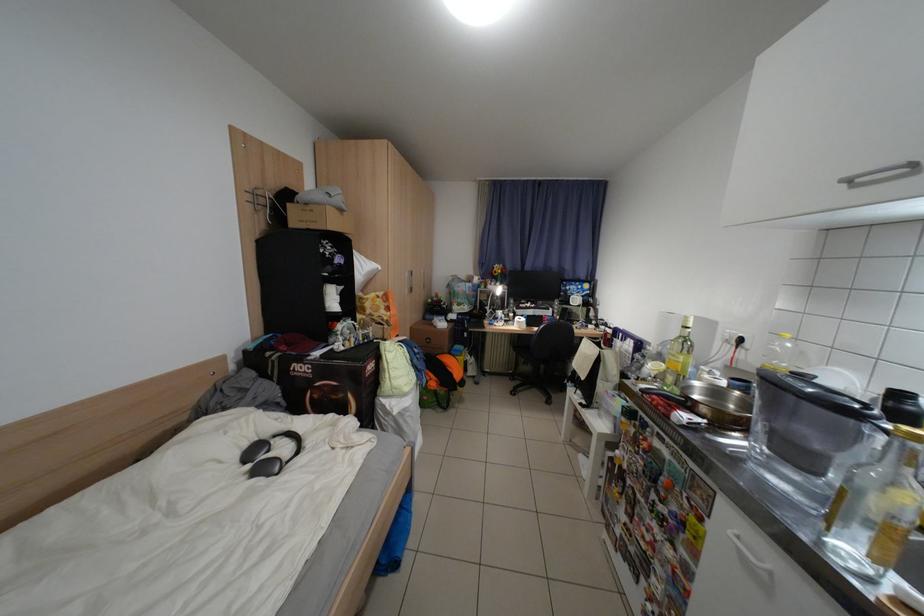
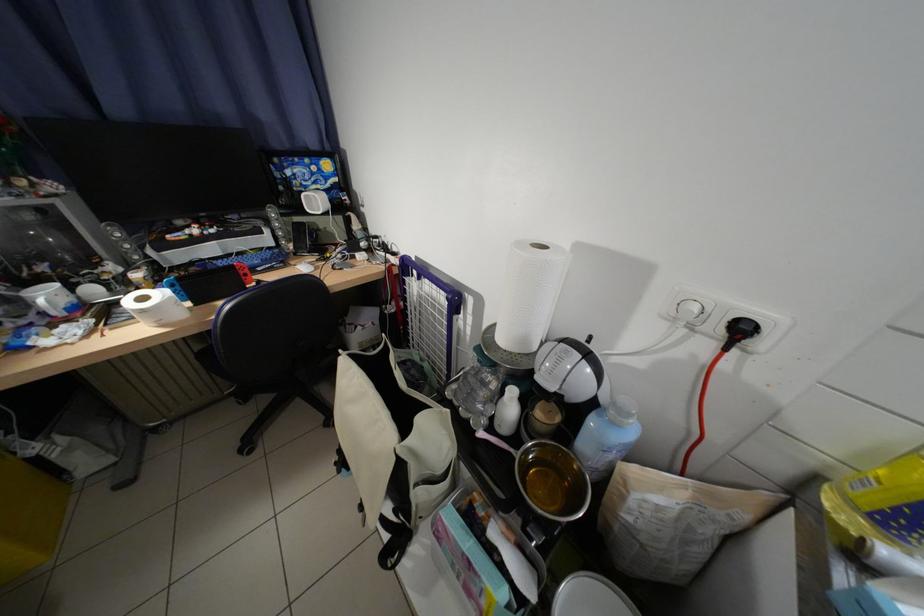
In the second image, find the point that corresponds to (512,314) in the first image.

(59, 297)